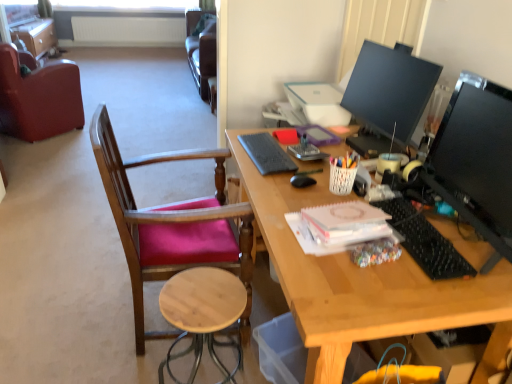
Question: Is black matte mouse at center turned away from gray matte keyboard at center, the first notepad in the top-to-bottom sequence?

Choices:
 (A) no
 (B) yes

Answer: (A)

Question: Considering the relative sizes of black matte mouse at center and gray matte keyboard at center, the second notepad viewed from the front, in the image provided, is black matte mouse at center smaller than gray matte keyboard at center, the second notepad viewed from the front,?

Choices:
 (A) yes
 (B) no

Answer: (A)

Question: Would you say black matte mouse at center is outside gray matte keyboard at center, which appears as the second notepad when ordered from the bottom?

Choices:
 (A) no
 (B) yes

Answer: (B)

Question: Is black matte mouse at center beside gray matte keyboard at center, the second notepad viewed from the front?

Choices:
 (A) yes
 (B) no

Answer: (B)

Question: Is black matte mouse at center not close to gray matte keyboard at center, the second notepad viewed from the front?

Choices:
 (A) yes
 (B) no

Answer: (B)

Question: From the image's perspective, is black glossy monitor at right, marked as the 2th television in a back-to-front arrangement, positioned above or below pink paper notepad at center, arranged as the 1th notepad when ordered from the bottom?

Choices:
 (A) below
 (B) above

Answer: (B)

Question: Is point (490, 82) positioned closer to the camera than point (335, 236)?

Choices:
 (A) farther
 (B) closer

Answer: (A)

Question: From a real-world perspective, is black glossy monitor at right, marked as the 2th television in a back-to-front arrangement, physically located above or below pink paper notepad at center, which ranks as the 2th notepad in top-to-bottom order?

Choices:
 (A) above
 (B) below

Answer: (A)

Question: Is black glossy monitor at right, marked as the 2th television in a back-to-front arrangement, wider or thinner than pink paper notepad at center, placed as the 1th notepad when sorted from front to back?

Choices:
 (A) wide
 (B) thin

Answer: (B)

Question: Considering the positions of black plastic keyboard at right and leather at left, arranged as the second chair when viewed from the front, in the image, is black plastic keyboard at right bigger or smaller than leather at left, arranged as the second chair when viewed from the front,?

Choices:
 (A) big
 (B) small

Answer: (B)

Question: From a real-world perspective, is black plastic keyboard at right above or below leather at left, marked as the second chair in a bottom-to-top arrangement?

Choices:
 (A) below
 (B) above

Answer: (B)

Question: Considering the positions of point [384, 210] and point [72, 62], is point [384, 210] closer or farther from the camera than point [72, 62]?

Choices:
 (A) farther
 (B) closer

Answer: (B)

Question: Choose the correct answer: Is black plastic keyboard at right inside leather at left, marked as the second chair in a bottom-to-top arrangement, or outside it?

Choices:
 (A) outside
 (B) inside

Answer: (A)

Question: In terms of width, does pink paper notepad at center, placed as the 1th notepad when sorted from front to back, look wider or thinner when compared to matte brown file cabinet at upper left?

Choices:
 (A) wide
 (B) thin

Answer: (B)

Question: In terms of size, does pink paper notepad at center, arranged as the 1th notepad when ordered from the bottom, appear bigger or smaller than matte brown file cabinet at upper left?

Choices:
 (A) small
 (B) big

Answer: (A)